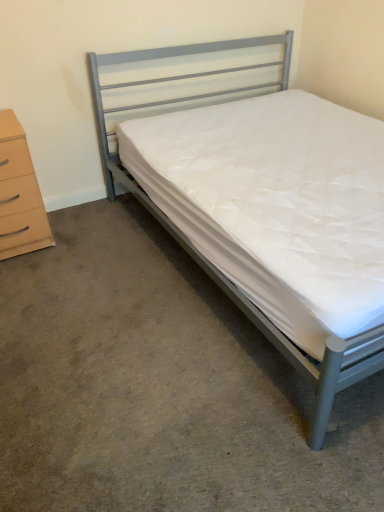
You are a GUI agent. You are given a task and a screenshot of the screen. Output one action in this format:
    pyautogui.click(x=<x>, y=<y>)
    Task: Click on the vacant space to the right of beige wood chest of drawers at left
    Image resolution: width=384 pixels, height=512 pixels.
    Given the screenshot: What is the action you would take?
    pyautogui.click(x=81, y=234)